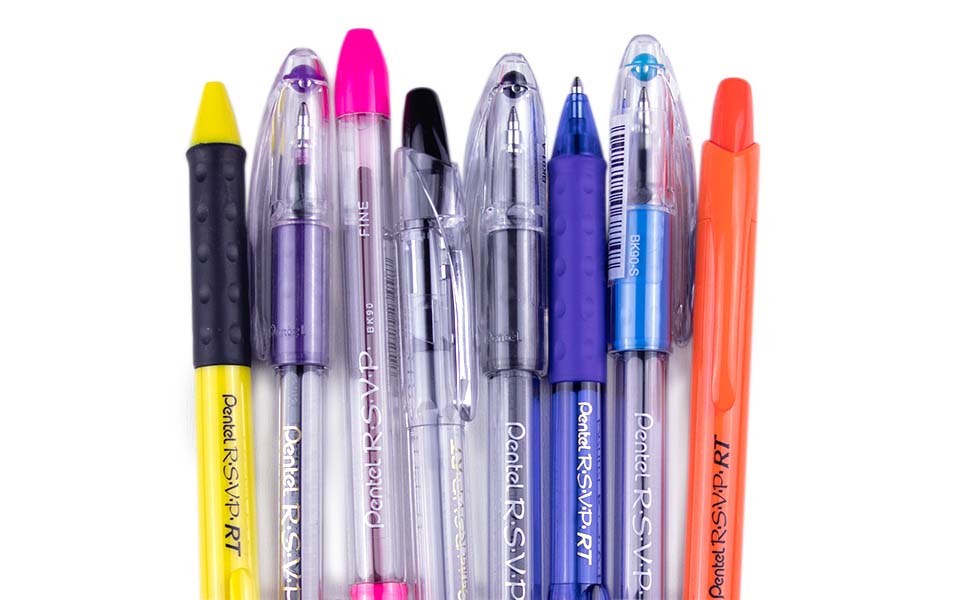
Identify the location of pens  (zoomed in). The image size is (970, 600). (215, 289), (297, 293), (373, 309), (432, 306), (509, 308), (574, 310), (658, 314), (723, 334).